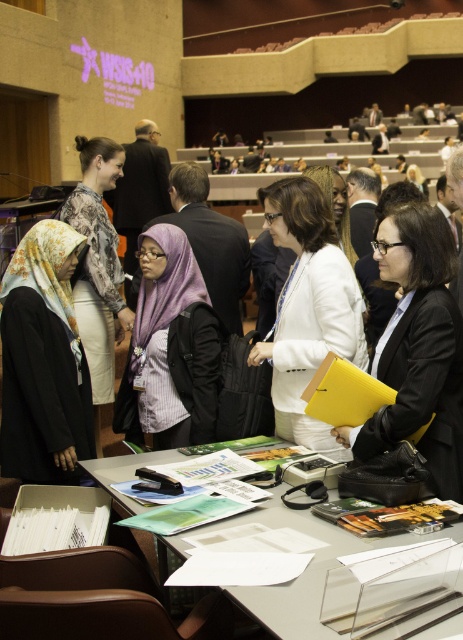
Question: Which point is closer to the camera taking this photo?

Choices:
 (A) (185, 428)
 (B) (112, 320)
 (C) (398, 412)

Answer: (C)

Question: Is the position of floral-patterned fabric hijab at left more distant than that of translucent plastic table at center?

Choices:
 (A) no
 (B) yes

Answer: (B)

Question: Does floral-patterned fabric hijab at left lie in front of white matte jacket at center?

Choices:
 (A) no
 (B) yes

Answer: (A)

Question: Is black leather jacket at center wider than translucent plastic table at center?

Choices:
 (A) yes
 (B) no

Answer: (B)

Question: Which point is farther to the camera?

Choices:
 (A) (160, 257)
 (B) (388, 337)

Answer: (A)

Question: Estimate the real-world distances between objects in this image. Which object is closer to the white matte jacket at center?

Choices:
 (A) translucent plastic table at center
 (B) printed silk blouse at upper left
 (C) black leather jacket at center

Answer: (C)